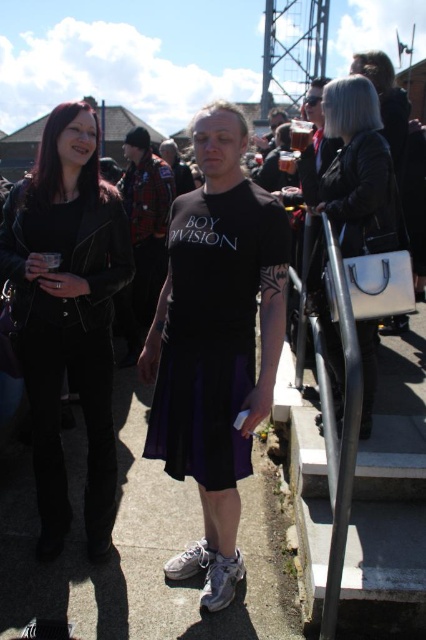
Based on the photo, can you confirm if silver metallic handbag at upper right is shorter than matte black t-shirt at center?

Yes.

Locate an element on the screen. This screenshot has width=426, height=640. silver metallic handbag at upper right is located at coordinates (359, 172).

The height and width of the screenshot is (640, 426). Identify the location of silver metallic handbag at upper right. (359, 172).

Is point (57, 182) positioned in front of point (129, 336)?

Yes, it is.

Between matte black leather jacket at left and plaid fabric shirt at center, which one is positioned higher?

plaid fabric shirt at center is higher up.

Which is behind, point (45, 125) or point (146, 227)?

Positioned behind is point (146, 227).

Locate an element on the screen. This screenshot has height=640, width=426. matte black leather jacket at left is located at coordinates (68, 314).

Does point (192, 232) come in front of point (126, 289)?

Yes.

Does point (241, 234) come behind point (135, 228)?

No, it is not.

I want to click on black matte skirt at center, so click(x=215, y=340).